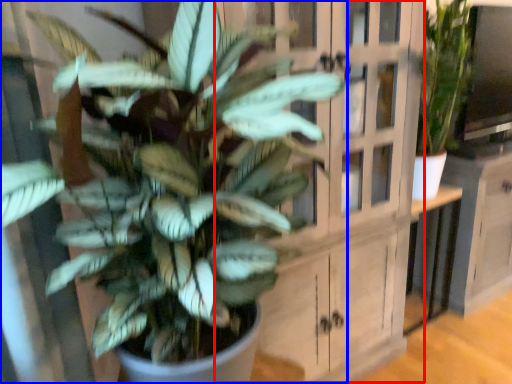
Question: Which of the following is the farthest to the observer, dresser (highlighted by a red box) or houseplant (highlighted by a blue box)?

Choices:
 (A) dresser
 (B) houseplant

Answer: (A)